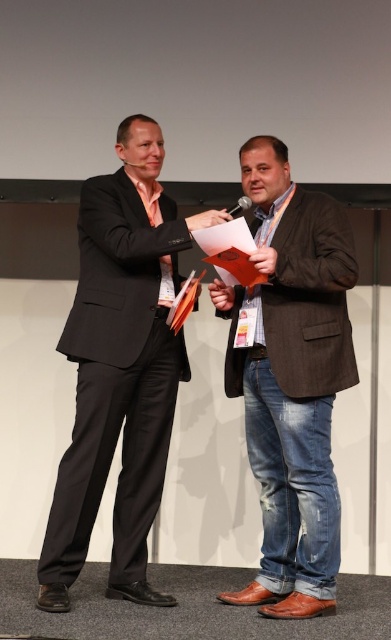
Question: Which object appears farthest from the camera in this image?

Choices:
 (A) matte black suit at left
 (B) brown leather shoes at center

Answer: (B)

Question: Does matte black suit at left have a lesser width compared to brown leather shoes at center?

Choices:
 (A) no
 (B) yes

Answer: (A)

Question: Does matte black suit at left appear on the left side of brown leather shoes at center?

Choices:
 (A) yes
 (B) no

Answer: (A)

Question: Which point is closer to the camera taking this photo?

Choices:
 (A) [118, 365]
 (B) [342, 339]

Answer: (B)

Question: Which of the following is the farthest from the observer?

Choices:
 (A) matte black suit at left
 (B) brown leather shoes at center

Answer: (B)

Question: Can you confirm if matte black suit at left is bigger than brown leather shoes at center?

Choices:
 (A) yes
 (B) no

Answer: (A)